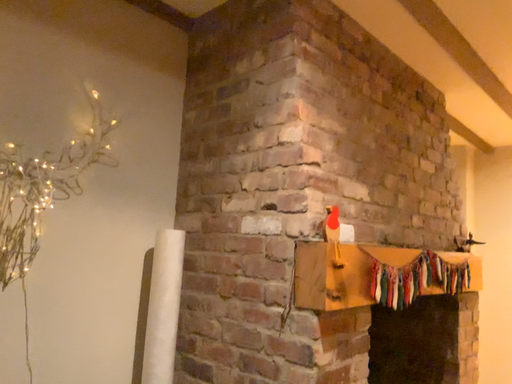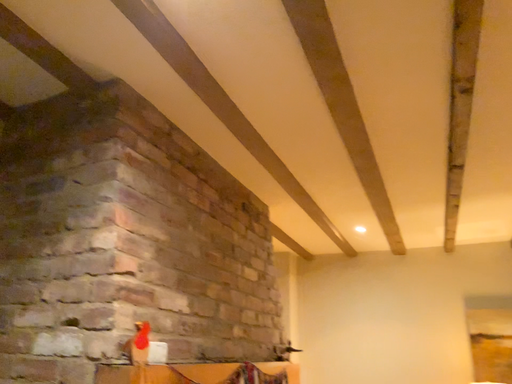
Question: Which way did the camera rotate in the video?

Choices:
 (A) rotated right
 (B) rotated left

Answer: (A)